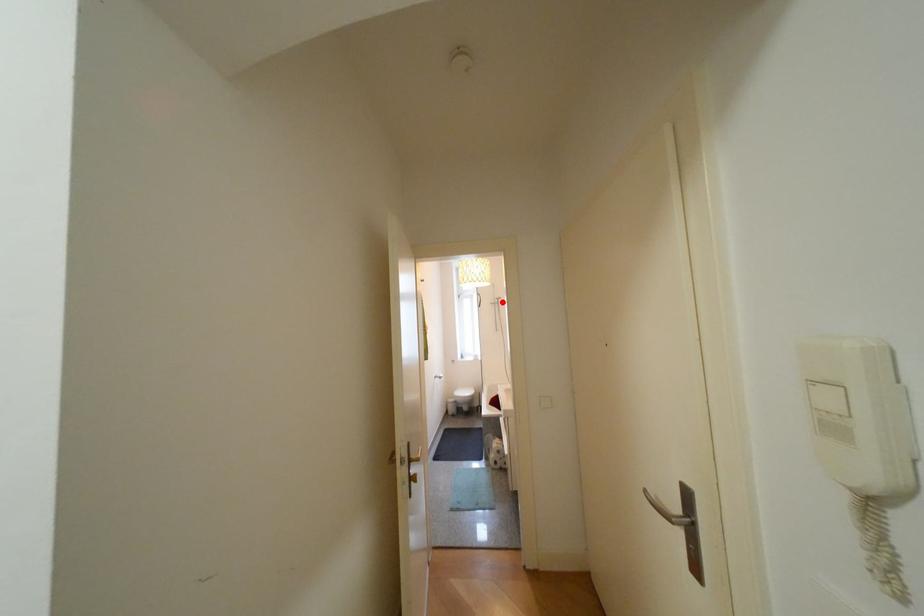
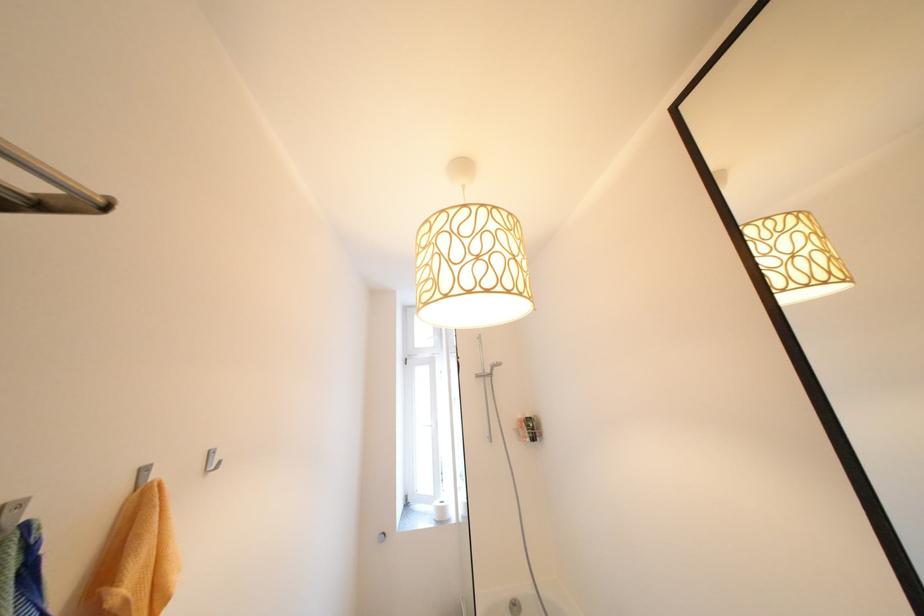
Locate, in the second image, the point that corresponds to the highlighted location in the first image.

(490, 371)